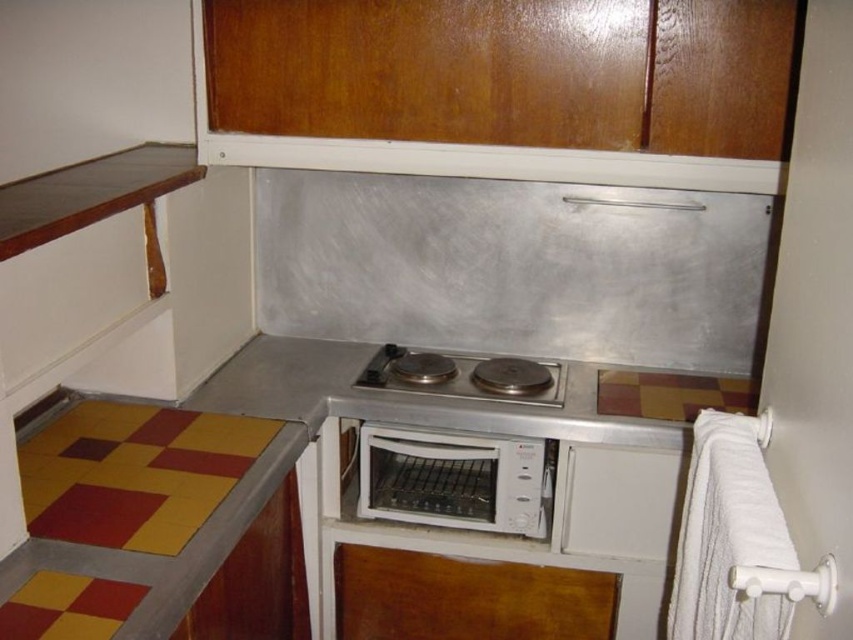
Is stainless steel countertop at center positioned before white plastic toaster oven at center?

Yes.

Between point (289, 355) and point (373, 440), which one is positioned in front?

Point (373, 440) is in front.

The width and height of the screenshot is (853, 640). What are the coordinates of `stainless steel countertop at center` in the screenshot? It's located at (418, 396).

Does white plastic toaster oven at center have a larger size compared to stainless steel cooktop at center?

Yes.

Consider the image. Can you confirm if white plastic toaster oven at center is positioned to the left of stainless steel cooktop at center?

Yes, white plastic toaster oven at center is to the left of stainless steel cooktop at center.

What do you see at coordinates (453, 480) in the screenshot? I see `white plastic toaster oven at center` at bounding box center [453, 480].

Where is `white plastic toaster oven at center`? white plastic toaster oven at center is located at coordinates (453, 480).

Is stainless steel countertop at center above stainless steel cooktop at center?

No, stainless steel countertop at center is not above stainless steel cooktop at center.

How far apart are stainless steel countertop at center and stainless steel cooktop at center?

stainless steel countertop at center and stainless steel cooktop at center are 3.59 inches apart from each other.

Is point (378, 412) positioned after point (374, 381)?

No, (378, 412) is in front of (374, 381).

At what (x,y) coordinates should I click in order to perform the action: click on stainless steel countertop at center. Please return your answer as a coordinate pair (x, y). Looking at the image, I should click on (418, 396).